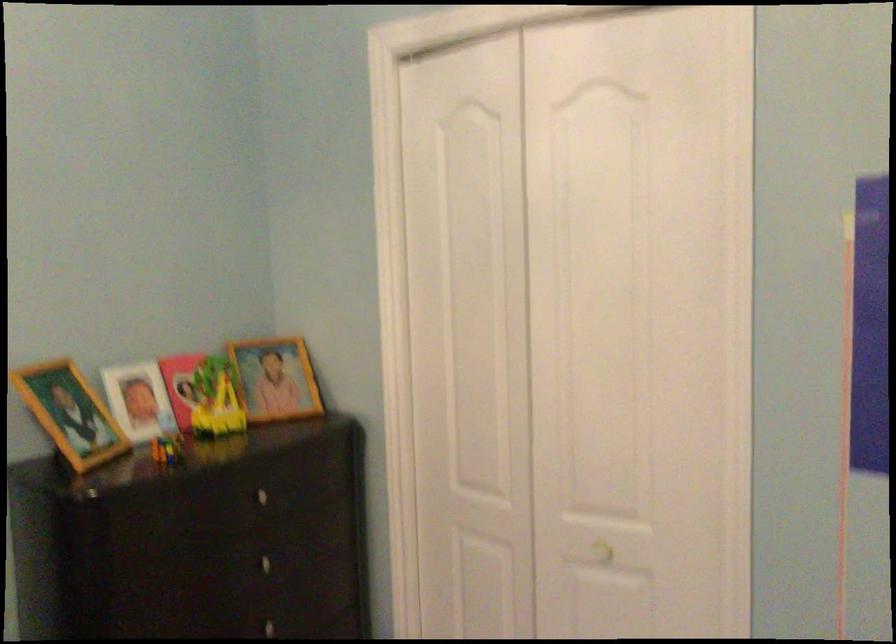
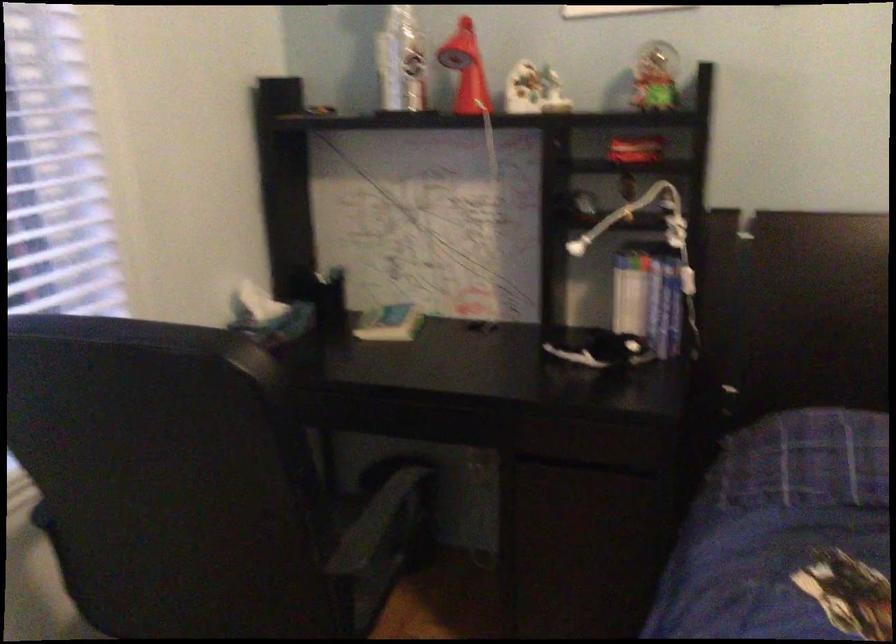
The first image is from the beginning of the video and the second image is from the end. How did the camera likely rotate when shooting the video?

The camera rotated toward left-down.